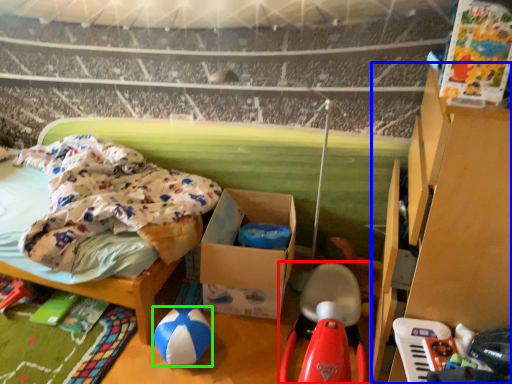
Question: Which is nearer to the toy (highlighted by a red box)? furniture (highlighted by a blue box) or toy (highlighted by a green box).

Choices:
 (A) furniture
 (B) toy

Answer: (A)